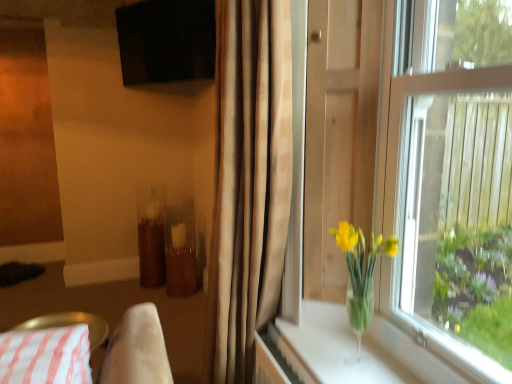
Question: From a real-world perspective, is beige fabric curtain at center above or below transparent glass vase at right, arranged as the first window screen when viewed from the front?

Choices:
 (A) below
 (B) above

Answer: (A)

Question: In the image, is beige fabric curtain at center on the left side or the right side of transparent glass vase at right, arranged as the first window screen when viewed from the front?

Choices:
 (A) left
 (B) right

Answer: (A)

Question: Which object is positioned closest to the black matte screen at upper center, the 2th window screen in the front-to-back sequence?

Choices:
 (A) transparent glass vase at right, arranged as the second window screen when viewed from the back
 (B) clear glass vase at lower right
 (C) translucent glass vase at window
 (D) white striped fabric at lower left
 (E) beige fabric curtain at center

Answer: (E)

Question: Which of these objects is positioned closest to the transparent glass vase at right, which appears as the 1th window screen when ordered from the bottom?

Choices:
 (A) translucent glass vase at window
 (B) black matte screen at upper center, which is the second window screen from bottom to top
 (C) clear glass vase at lower right
 (D) beige fabric curtain at center
 (E) white striped fabric at lower left

Answer: (A)